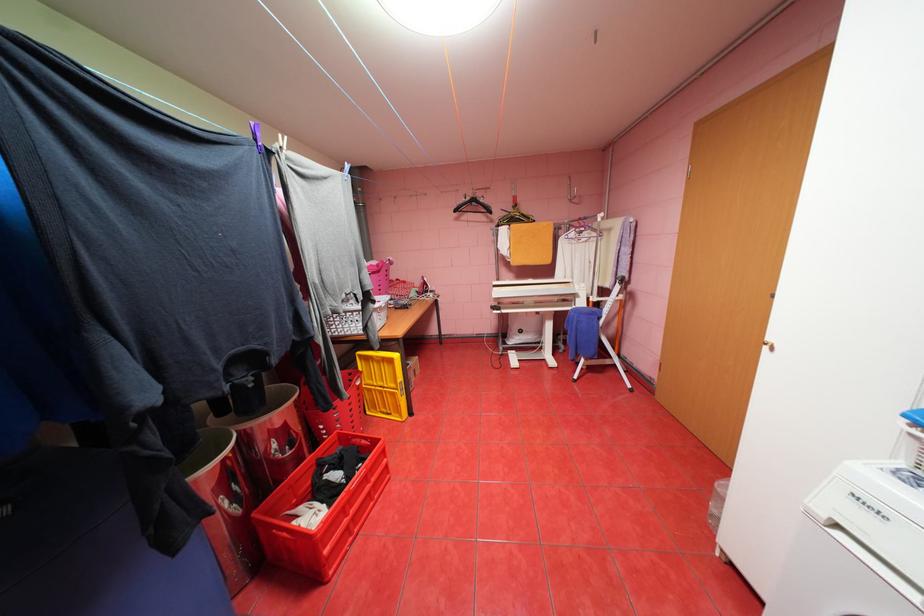
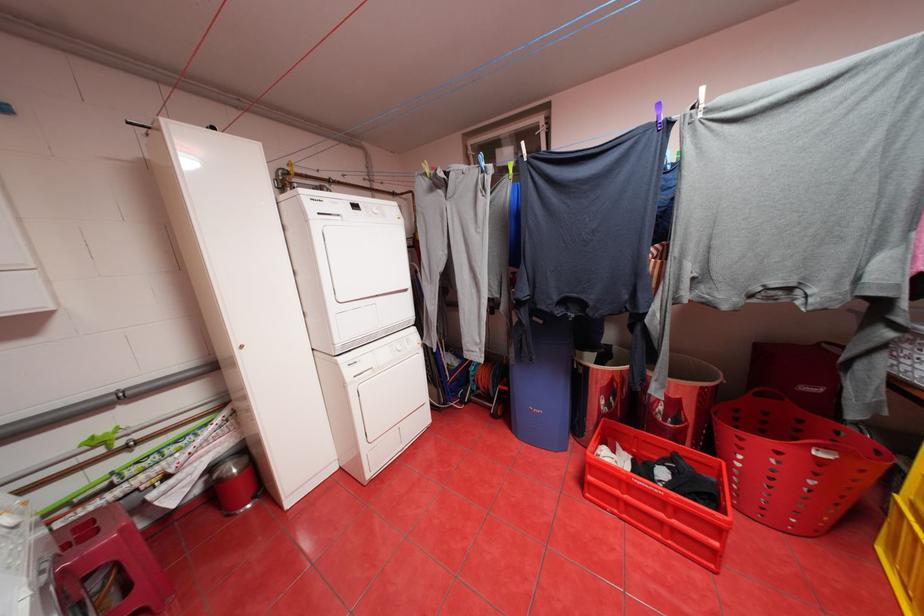
Based on the continuous images, in which direction is the camera rotating?

The rotation direction of the camera is left-down.